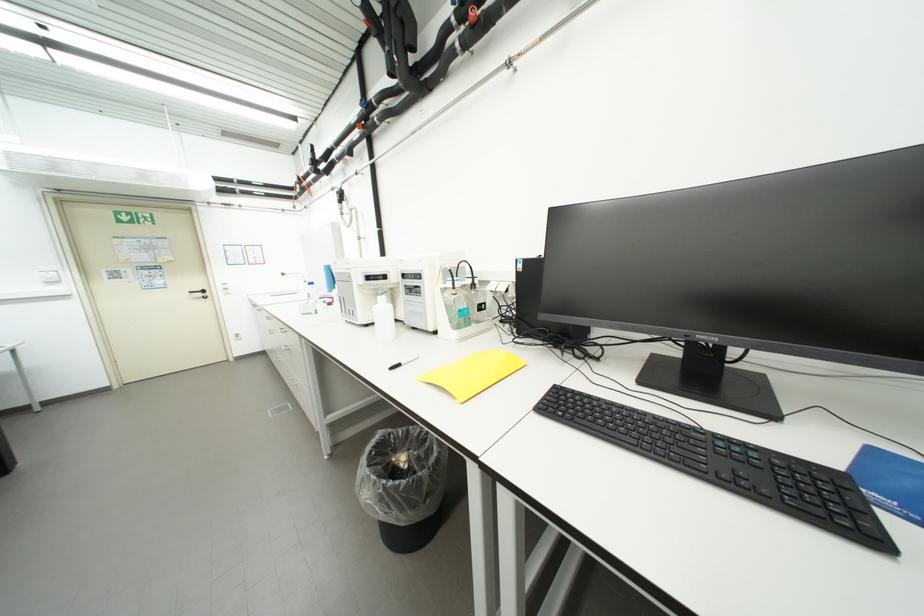
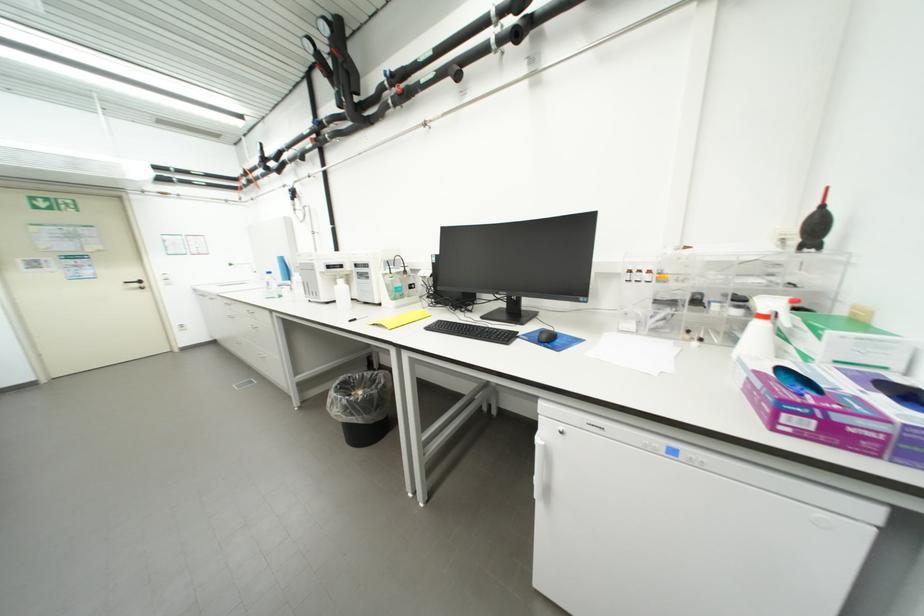
The point at (x=208, y=296) is marked in the first image. Where is the corresponding point in the second image?

(144, 286)